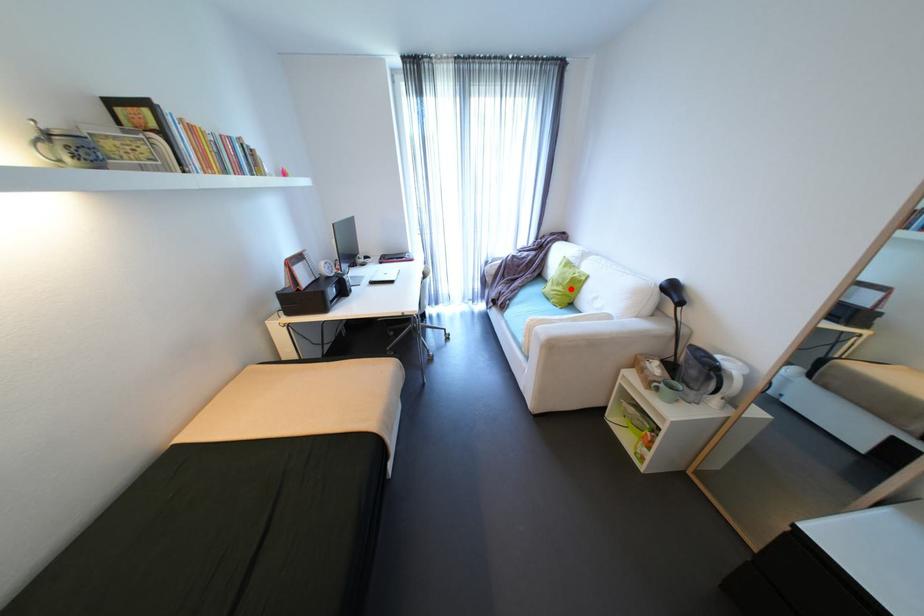
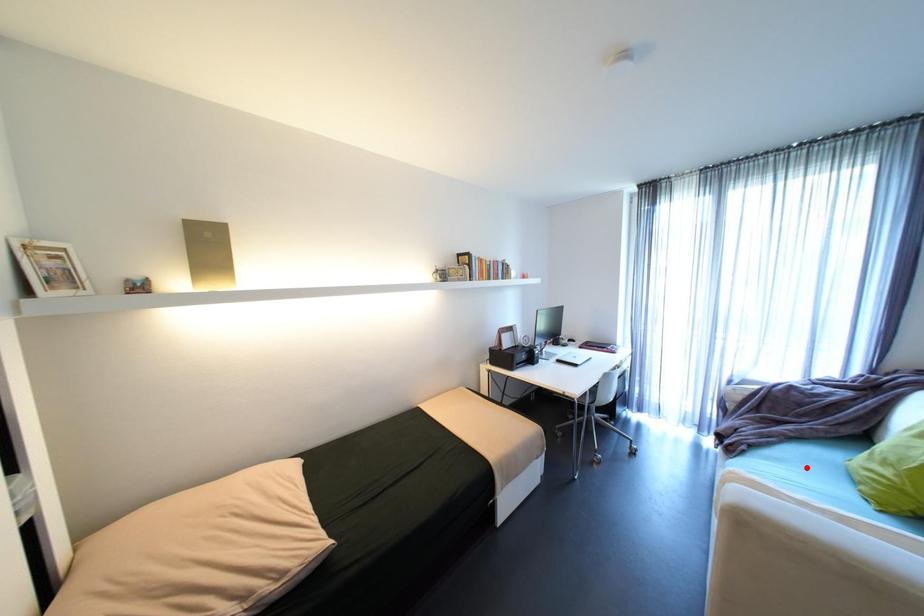
I am providing you with two images of the same scene from different viewpoints. A red point is marked on the first image and another point is marked on the second image. Is the marked point in image1 the same physical position as the marked point in image2?

No